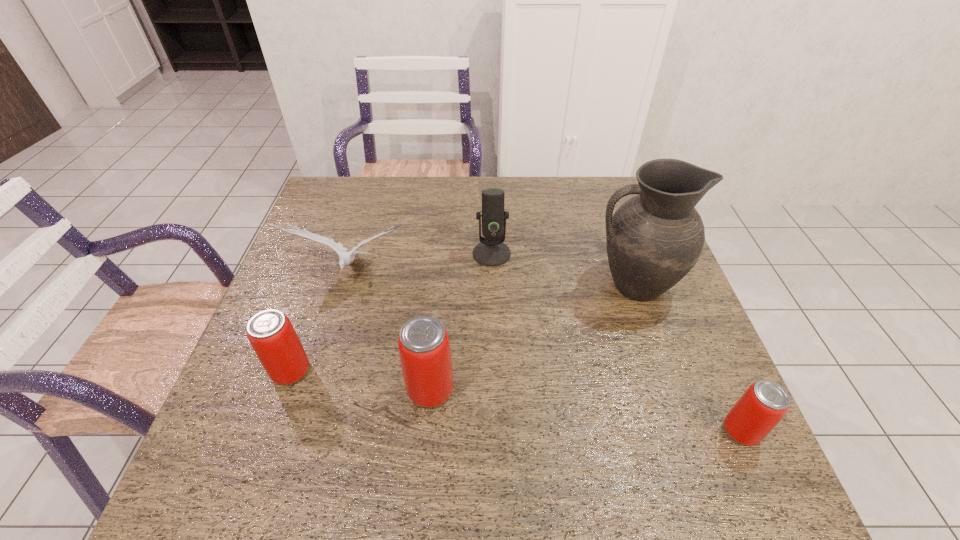
Identify the location of the second tallest beer can. This screenshot has height=540, width=960. (270, 333).

I want to click on the fourth object from right to left, so click(x=424, y=348).

Where is `the nearest beer can`? Image resolution: width=960 pixels, height=540 pixels. the nearest beer can is located at coordinates (762, 406).

At what (x,y) coordinates should I click in order to perform the action: click on the shortest beer can. Please return your answer as a coordinate pair (x, y). This screenshot has height=540, width=960. Looking at the image, I should click on (762, 406).

This screenshot has height=540, width=960. In order to click on microphone in this screenshot , I will do `click(491, 251)`.

You are a GUI agent. You are given a task and a screenshot of the screen. Output one action in this format:
    pyautogui.click(x=<x>, y=<y>)
    Task: Click on the gull
    This screenshot has height=540, width=960.
    Given the screenshot: What is the action you would take?
    pyautogui.click(x=345, y=258)

Locate an element on the screen. the tallest object is located at coordinates coord(653,240).

This screenshot has height=540, width=960. I want to click on free point located 0.380m on the right of the second shortest beer can, so click(485, 371).

Where is `free space located on the back of the third object from left to right`? The height and width of the screenshot is (540, 960). free space located on the back of the third object from left to right is located at coordinates 436,330.

Where is `free space located 0.330m on the left of the nearest object`? free space located 0.330m on the left of the nearest object is located at coordinates (555, 431).